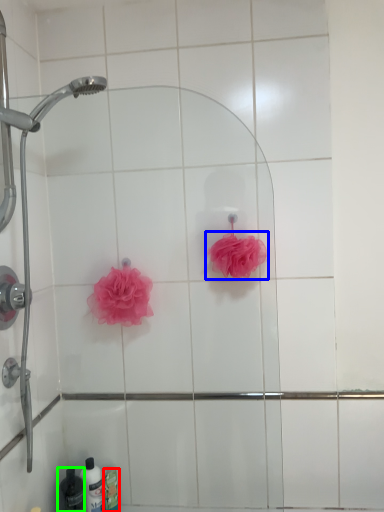
Question: Considering the real-world distances, which object is closest to toiletry (highlighted by a red box)? rose (highlighted by a blue box) or toiletry (highlighted by a green box).

Choices:
 (A) rose
 (B) toiletry

Answer: (B)